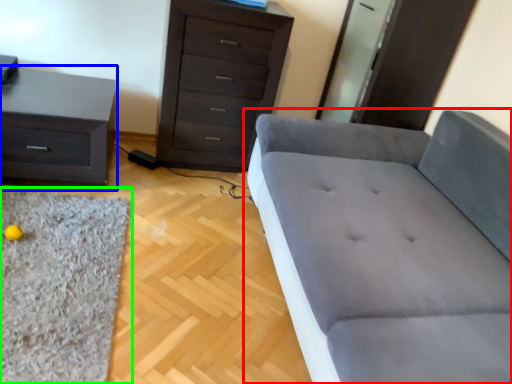
Question: Based on their relative distances, which object is farther from studio couch (highlighted by a red box)? Choose from nightstand (highlighted by a blue box) and mat (highlighted by a green box).

Choices:
 (A) nightstand
 (B) mat

Answer: (A)